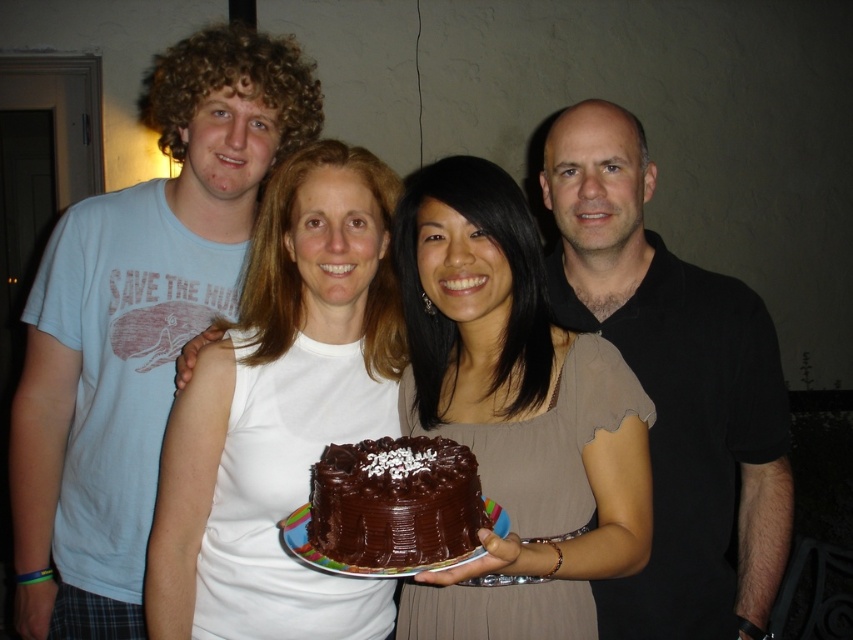
Question: Considering the real-world distances, which object is farthest from the white matte shirt at center?

Choices:
 (A) chocolatesmoothcake at center
 (B) smooth chocolate cake at center

Answer: (A)

Question: Which object is positioned farthest from the matte blue t-shirt at left?

Choices:
 (A) smooth chocolate cake at center
 (B) white matte shirt at center
 (C) chocolate frosted cake at center

Answer: (C)

Question: Does black matte shirt at right have a smaller size compared to chocolatesmoothcake at center?

Choices:
 (A) yes
 (B) no

Answer: (B)

Question: Is black matte shirt at right below chocolate frosted cake at center?

Choices:
 (A) no
 (B) yes

Answer: (A)

Question: Which of the following is the farthest from the observer?

Choices:
 (A) (387, 566)
 (B) (602, 493)

Answer: (B)

Question: Is matte blue t-shirt at left thinner than chocolatesmoothcake at center?

Choices:
 (A) no
 (B) yes

Answer: (A)